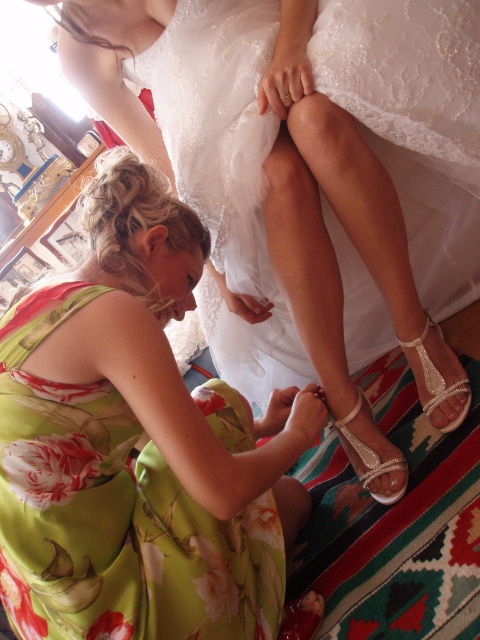
Does green floral dress at lower left appear on the right side of clear crystal sandal at lower right?

Incorrect, green floral dress at lower left is not on the right side of clear crystal sandal at lower right.

Looking at this image, can you confirm if green floral dress at lower left is smaller than clear crystal sandal at lower right?

No, green floral dress at lower left is not smaller than clear crystal sandal at lower right.

Who is more forward, (191, 472) or (448, 428)?

Point (191, 472) is more forward.

Find the location of a particular element. The image size is (480, 640). green floral dress at lower left is located at coordinates (137, 445).

Based on the photo, between green floral dress at lower left and satin white sandal at lower center, which one is positioned lower?

satin white sandal at lower center is below.

Is point (140, 384) less distant than point (315, 627)?

Yes.

This screenshot has height=640, width=480. I want to click on green floral dress at lower left, so click(137, 445).

Where is `green floral dress at lower left`? This screenshot has height=640, width=480. green floral dress at lower left is located at coordinates (137, 445).

Between white lace dress at center and green floral dress at lower left, which one is positioned higher?

white lace dress at center is above.

Identify the location of white lace dress at center. (302, 163).